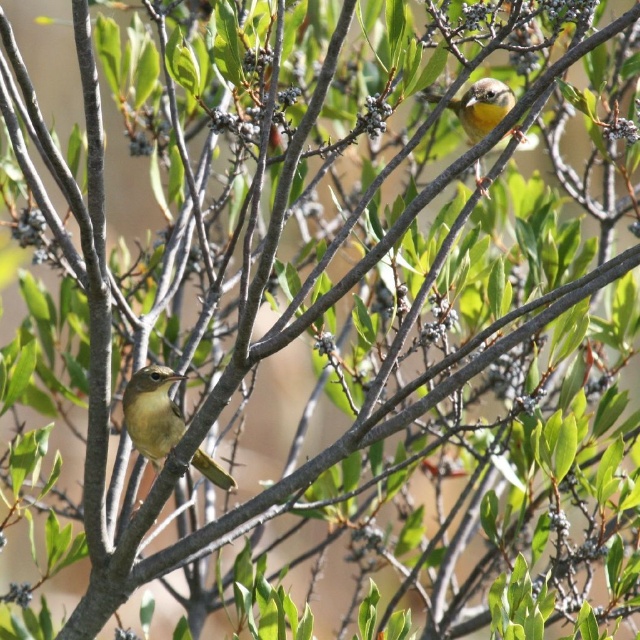
You are a birdwatcher trying to locate the green matte bird at center. Based on the coordinates provided, can you determine its position relative to the tree branches?

The green matte bird at center is located at coordinates point (x=152, y=412), which places it on a lower branch of the tree.